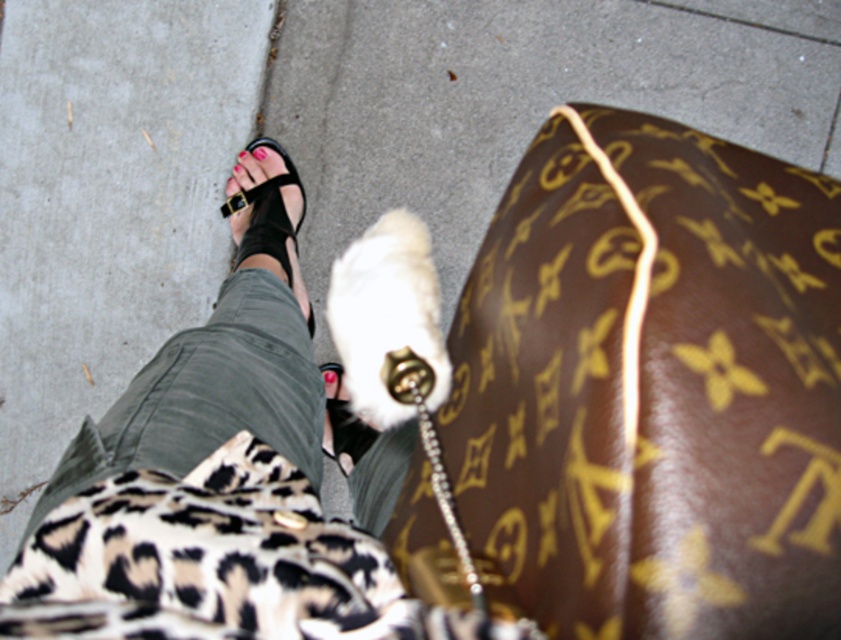
Question: Is black leather sandal at center to the left of pink matte nail at center from the viewer's perspective?

Choices:
 (A) no
 (B) yes

Answer: (A)

Question: Is black leather sandal at center above pink matte nail at center?

Choices:
 (A) yes
 (B) no

Answer: (B)

Question: Is black leather sandal at center thinner than pink matte nail at center?

Choices:
 (A) yes
 (B) no

Answer: (B)

Question: Among these objects, which one is farthest from the camera?

Choices:
 (A) pink matte nail at center
 (B) black leather sandal at center

Answer: (A)

Question: Which object appears closest to the camera in this image?

Choices:
 (A) black leather sandal at center
 (B) pink matte nail at center

Answer: (A)